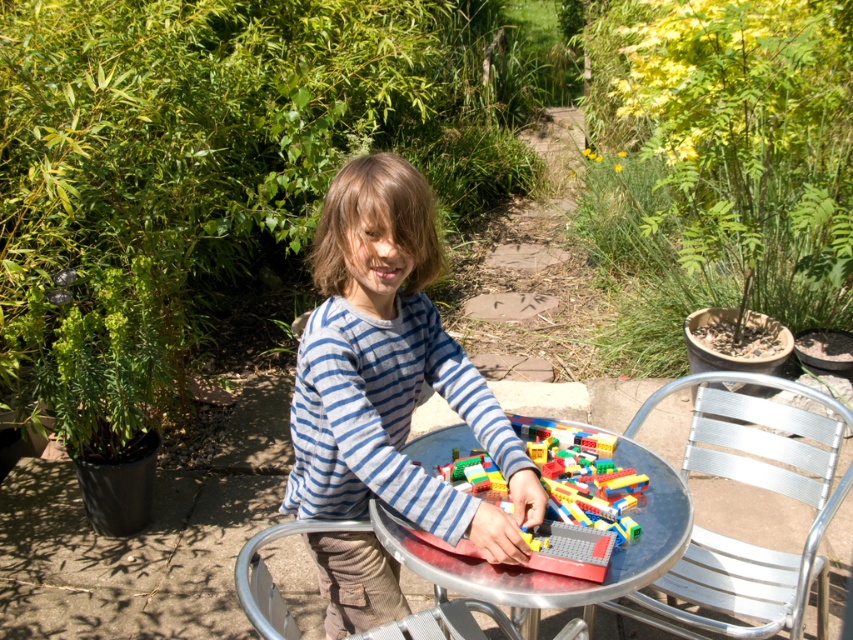
Question: Can you confirm if green leafy plant at upper right is wider than bright plastic lego bricks at center?

Choices:
 (A) yes
 (B) no

Answer: (A)

Question: Estimate the real-world distances between objects in this image. Which object is farther from the metallic silver chair at lower center?

Choices:
 (A) green leafy plant at upper right
 (B) metallic silver table at center
 (C) blue striped shirt at center
 (D) bright plastic lego bricks at center

Answer: (A)

Question: Is the position of silver metallic chair at lower right more distant than that of metallic silver chair at lower center?

Choices:
 (A) yes
 (B) no

Answer: (A)

Question: Can you confirm if silver metallic chair at lower right is bigger than metallic silver chair at lower center?

Choices:
 (A) no
 (B) yes

Answer: (B)

Question: Estimate the real-world distances between objects in this image. Which object is farther from the blue striped shirt at center?

Choices:
 (A) metallic silver table at center
 (B) silver metallic chair at lower right
 (C) bright plastic lego bricks at center

Answer: (B)

Question: Estimate the real-world distances between objects in this image. Which object is farther from the metallic silver chair at lower center?

Choices:
 (A) blue striped shirt at center
 (B) metallic silver table at center
 (C) silver metallic chair at lower right
 (D) green leafy plant at upper right

Answer: (D)